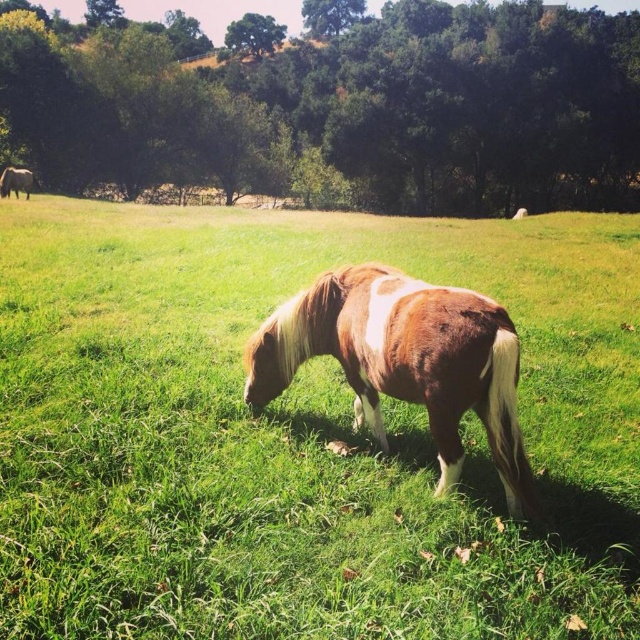
Question: Which object is farther from the camera taking this photo?

Choices:
 (A) brown glossy horse at upper left
 (B) brown/white textured horse at center

Answer: (A)

Question: Is brown/white textured horse at center further to camera compared to brown glossy horse at upper left?

Choices:
 (A) yes
 (B) no

Answer: (B)

Question: Among these points, which one is farthest from the camera?

Choices:
 (A) (4, 172)
 (B) (54, 472)

Answer: (A)

Question: Does green grassy field at center appear under brown glossy horse at upper left?

Choices:
 (A) yes
 (B) no

Answer: (A)

Question: Estimate the real-world distances between objects in this image. Which object is farther from the green grassy field at center?

Choices:
 (A) brown/white textured horse at center
 (B) brown glossy horse at upper left

Answer: (B)

Question: Does green grassy field at center appear on the left side of brown glossy horse at upper left?

Choices:
 (A) no
 (B) yes

Answer: (A)